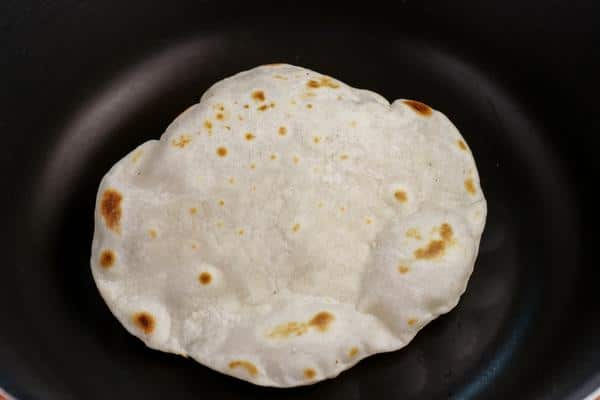
Where is `metal top of pan`? metal top of pan is located at coordinates (593, 394), (6, 395).